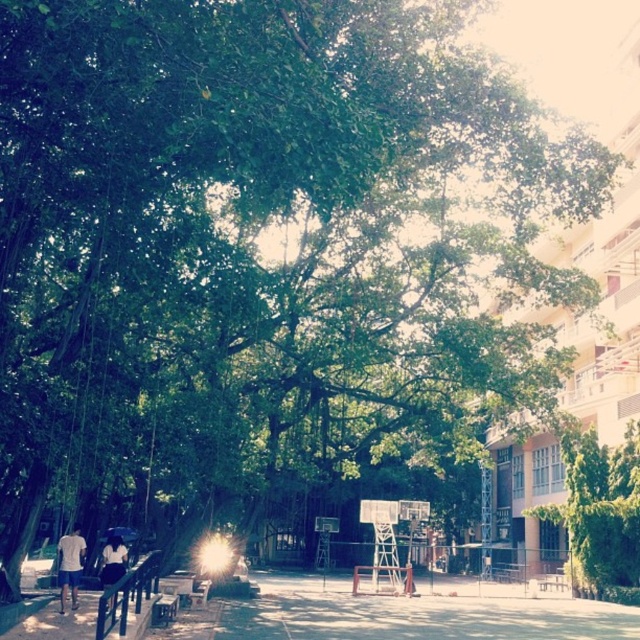
Can you confirm if metallic silver basketball hoop at center is taller than white cotton shirt at lower left?

Indeed, metallic silver basketball hoop at center has a greater height compared to white cotton shirt at lower left.

Between metallic silver basketball hoop at center and white cotton shirt at lower left, which one appears on the right side from the viewer's perspective?

metallic silver basketball hoop at center is more to the right.

Is point (374, 529) farther from camera compared to point (109, 548)?

That is True.

Where is `metallic silver basketball hoop at center`? The image size is (640, 640). metallic silver basketball hoop at center is located at coordinates tap(390, 540).

Which is below, green leafy tree at center or wooden park bench at center?

wooden park bench at center is below.

Locate an element on the screen. Image resolution: width=640 pixels, height=640 pixels. green leafy tree at center is located at coordinates (598, 508).

The image size is (640, 640). Find the location of `green leafy tree at center`. green leafy tree at center is located at coordinates (598, 508).

Does white cotton shirt at lower left appear over blue fabric umbrella at lower left?

Indeed, white cotton shirt at lower left is positioned over blue fabric umbrella at lower left.

Is the position of white cotton shirt at lower left less distant than that of blue fabric umbrella at lower left?

Yes, it is.

Which is behind, point (100, 576) or point (124, 531)?

Point (124, 531)

You are a GUI agent. You are given a task and a screenshot of the screen. Output one action in this format:
    pyautogui.click(x=<x>, y=<y>)
    Task: Click on the white cotton shirt at lower left
    The height and width of the screenshot is (640, 640).
    Given the screenshot: What is the action you would take?
    pyautogui.click(x=113, y=561)